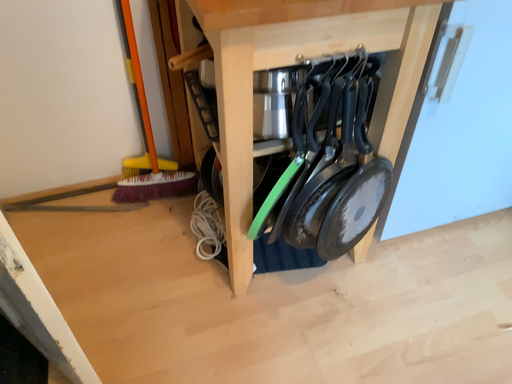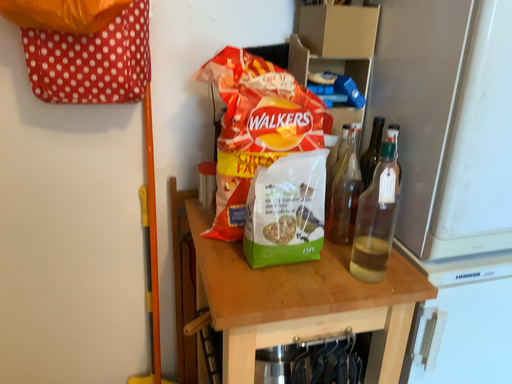
Question: How did the camera likely rotate when shooting the video?

Choices:
 (A) rotated downward
 (B) rotated upward

Answer: (B)